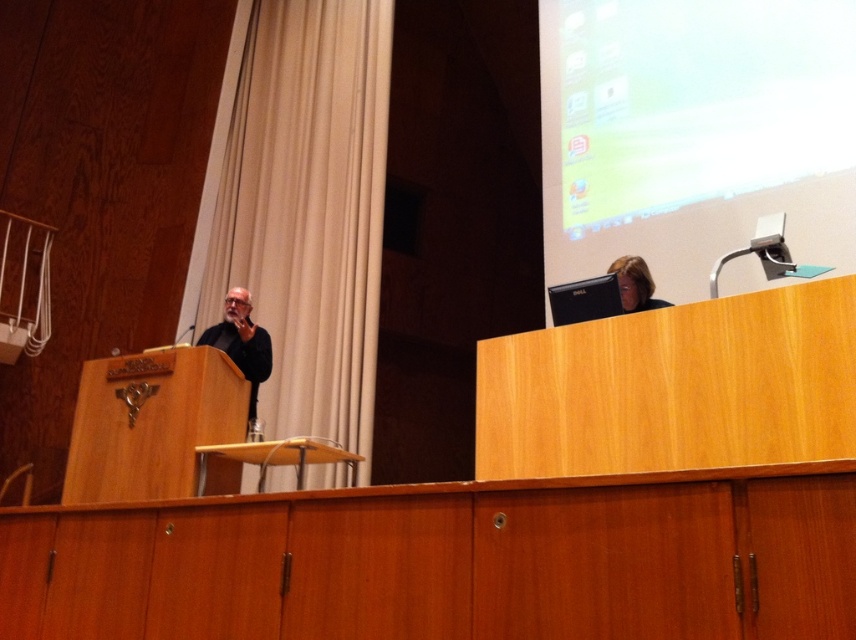
Is the position of matte plastic projection screen at upper right more distant than that of matte black laptop at upper right?

Yes, matte plastic projection screen at upper right is further from the viewer.

Where is `matte plastic projection screen at upper right`? matte plastic projection screen at upper right is located at coordinates click(x=694, y=132).

Is point (693, 113) more distant than point (214, 332)?

No, (693, 113) is in front of (214, 332).

Measure the distance between point (554, 148) and camera.

A distance of 4.81 meters exists between point (554, 148) and camera.

Where is `matte plastic projection screen at upper right`? matte plastic projection screen at upper right is located at coordinates (694, 132).

This screenshot has height=640, width=856. I want to click on beige fabric curtain at left, so click(x=308, y=209).

From the picture: Who is shorter, beige fabric curtain at left or black matte jacket at left?

black matte jacket at left

Does point (372, 259) come farther from viewer compared to point (257, 340)?

Yes, point (372, 259) is behind point (257, 340).

The height and width of the screenshot is (640, 856). What are the coordinates of `beige fabric curtain at left` in the screenshot? It's located at (308, 209).